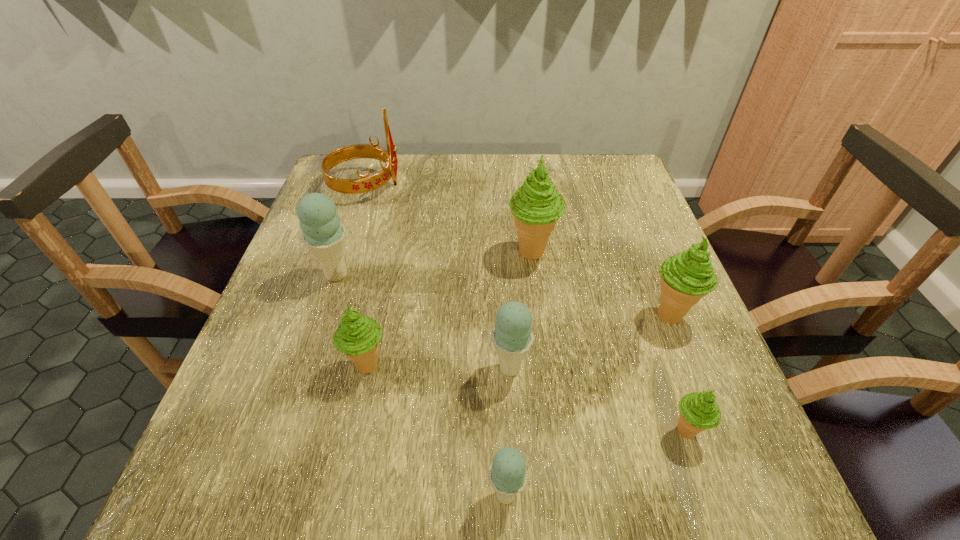
Image resolution: width=960 pixels, height=540 pixels. Find the location of `unoccupied position between the smallest blue ice cream and the second nearest blue ice cream`. unoccupied position between the smallest blue ice cream and the second nearest blue ice cream is located at coordinates (508, 431).

This screenshot has height=540, width=960. Identify the location of free spot between the leftmost ice cream and the farthest green icecream. (435, 264).

At what (x,y) coordinates should I click in order to perform the action: click on empty space between the second smallest blue ice cream and the tiara. Please return your answer as a coordinate pair (x, y). The height and width of the screenshot is (540, 960). Looking at the image, I should click on (438, 276).

Identify which object is the closest to the leftmost blue ice cream. Please provide its 2D coordinates. Your answer should be formatted as a tuple, i.e. [(x, y)], where the tuple contains the x and y coordinates of a point satisfying the conditions above.

[(358, 336)]

This screenshot has height=540, width=960. What are the coordinates of `object that is the fifth closest to the second smallest green icecream` in the screenshot? It's located at (365, 183).

This screenshot has width=960, height=540. I want to click on ice cream that can be found as the third closest to the biggest blue ice cream, so 536,206.

The width and height of the screenshot is (960, 540). I want to click on ice cream that is the second closest to the third green icecream from right to left, so click(512, 336).

Identify which green icecream is the nearest to the nearest object. Please provide its 2D coordinates. Your answer should be formatted as a tuple, i.e. [(x, y)], where the tuple contains the x and y coordinates of a point satisfying the conditions above.

[(358, 336)]

Choose which green icecream is the second nearest neighbor to the leftmost blue ice cream. Please provide its 2D coordinates. Your answer should be formatted as a tuple, i.e. [(x, y)], where the tuple contains the x and y coordinates of a point satisfying the conditions above.

[(536, 206)]

Locate an element on the screen. the third closest blue ice cream to the smallest green icecream is located at coordinates 324,235.